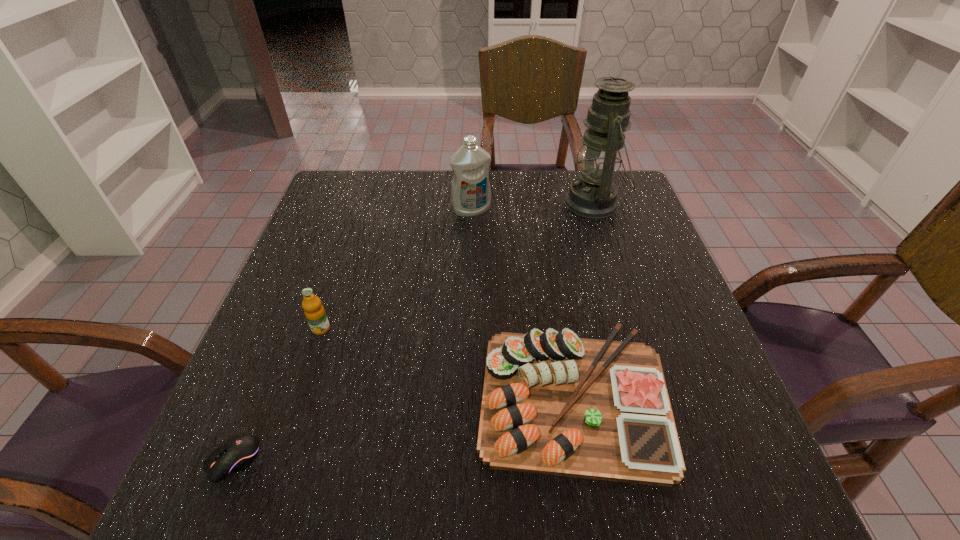
Locate an element on the screen. The image size is (960, 540). free space that satisfies the following two spatial constraints: 1. on the back side of the leftmost object; 2. on the left side of the detergent is located at coordinates (334, 210).